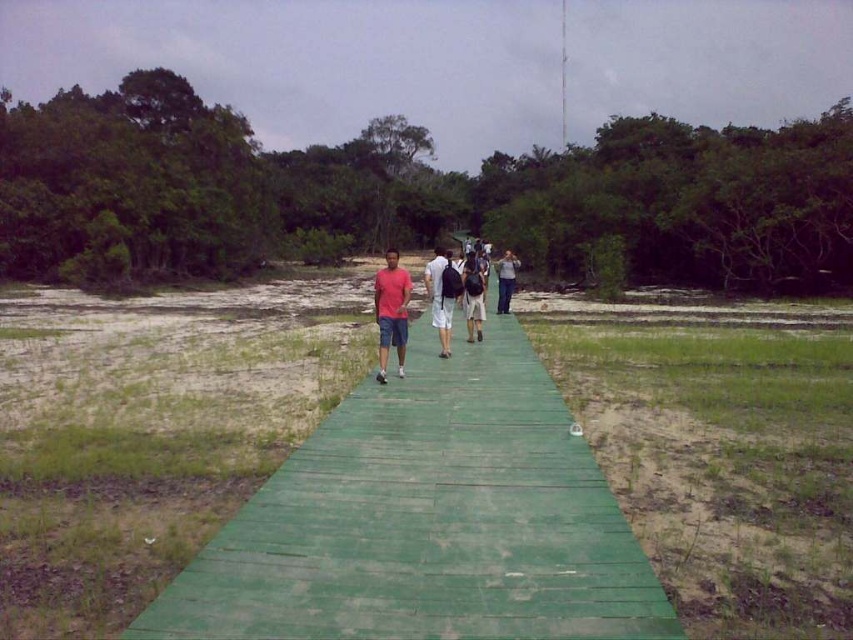
Question: Is green wooden path at center bigger than matte pink shirt at center?

Choices:
 (A) no
 (B) yes

Answer: (A)

Question: Considering the real-world distances, which object is closest to the green wooden path at center?

Choices:
 (A) matte gray shirt at center
 (B) matte pink shirt at center

Answer: (B)

Question: Which of these objects is positioned farthest from the matte pink shirt at center?

Choices:
 (A) matte black backpack at center
 (B) green wooden path at center
 (C) light gray backpack at center

Answer: (B)

Question: Among these points, which one is farthest from the camera?

Choices:
 (A) (474, 278)
 (B) (514, 605)
 (C) (502, 273)

Answer: (C)

Question: Can you confirm if matte black backpack at center is positioned to the left of matte gray shirt at center?

Choices:
 (A) no
 (B) yes

Answer: (B)

Question: Observing the image, what is the correct spatial positioning of green wooden path at center in reference to matte black backpack at center?

Choices:
 (A) left
 (B) right

Answer: (A)